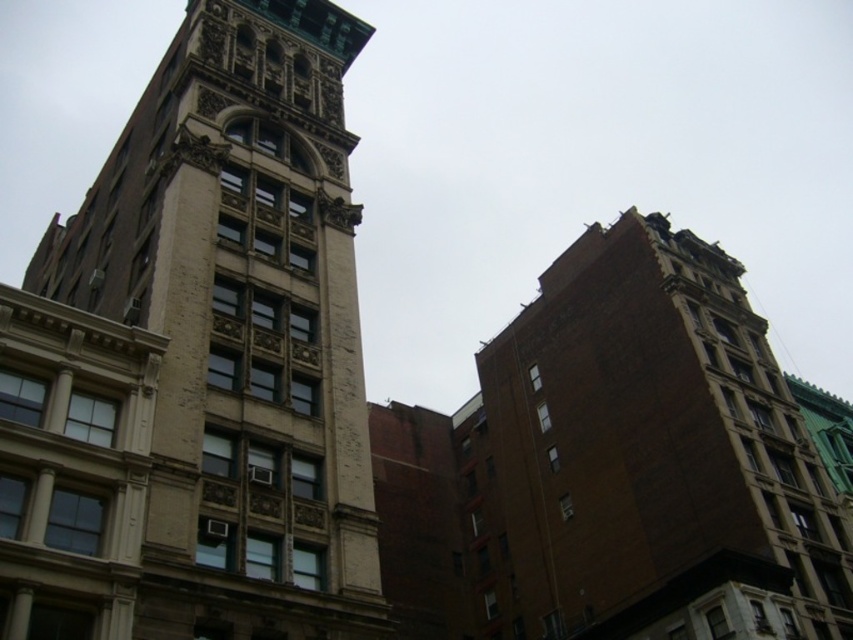
Question: Which of the following is the farthest from the observer?

Choices:
 (A) white stone tower at center
 (B) brown brick tower at right

Answer: (B)

Question: Does white stone tower at center have a lesser width compared to brown brick tower at right?

Choices:
 (A) yes
 (B) no

Answer: (B)

Question: Is white stone tower at center to the right of brown brick tower at right from the viewer's perspective?

Choices:
 (A) yes
 (B) no

Answer: (B)

Question: Among these objects, which one is nearest to the camera?

Choices:
 (A) white stone tower at center
 (B) brown brick tower at right

Answer: (A)

Question: Is white stone tower at center thinner than brown brick tower at right?

Choices:
 (A) yes
 (B) no

Answer: (B)